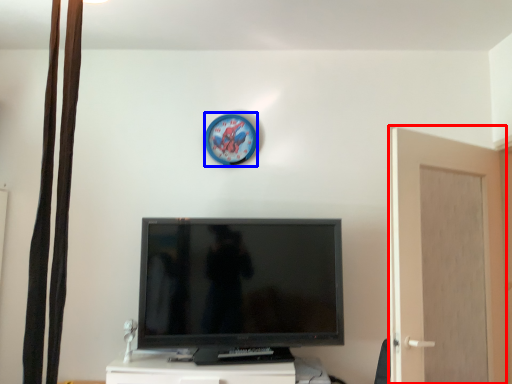
Question: Which point is closer to the camera, screen door (highlighted by a red box) or clock (highlighted by a blue box)?

Choices:
 (A) screen door
 (B) clock

Answer: (A)